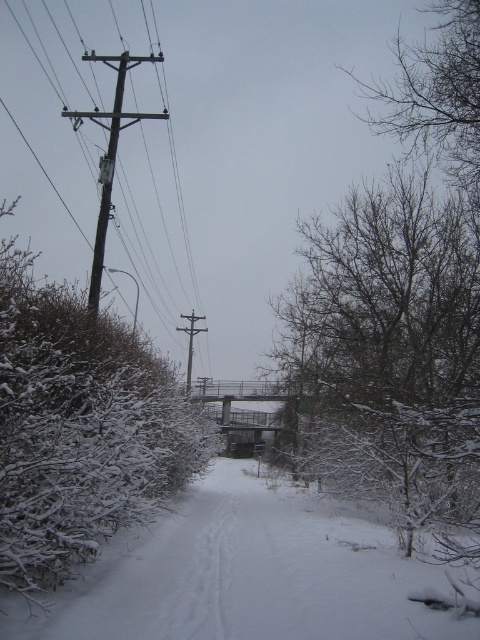
You are an observer standing at the edge of the snowy path. You notice the bare branches at center and the wooden utility pole at left. Which object appears closer to you in size?

The wooden utility pole at left is larger than the bare branches at center, so the wooden utility pole at left appears closer in size.

You are a delivery drone that needs to fly from the wooden utility pole at left to the bare branches at center. The drone has a maximum flight range of 10 meters. Can it make the trip without recharging?

The distance between the wooden utility pole at left and the bare branches at center is 11.54 meters, which exceeds the drone s 10 meter range. Therefore, the drone cannot complete the trip without recharging.

You are a hiker trying to navigate through the snowy area. You see the white snow path at center and the brown wooden pole at left. Which object is located to the right of the other?

The white snow path at center is positioned on the right side of brown wooden pole at left, so the white snow path at center is to the right of the brown wooden pole at left.